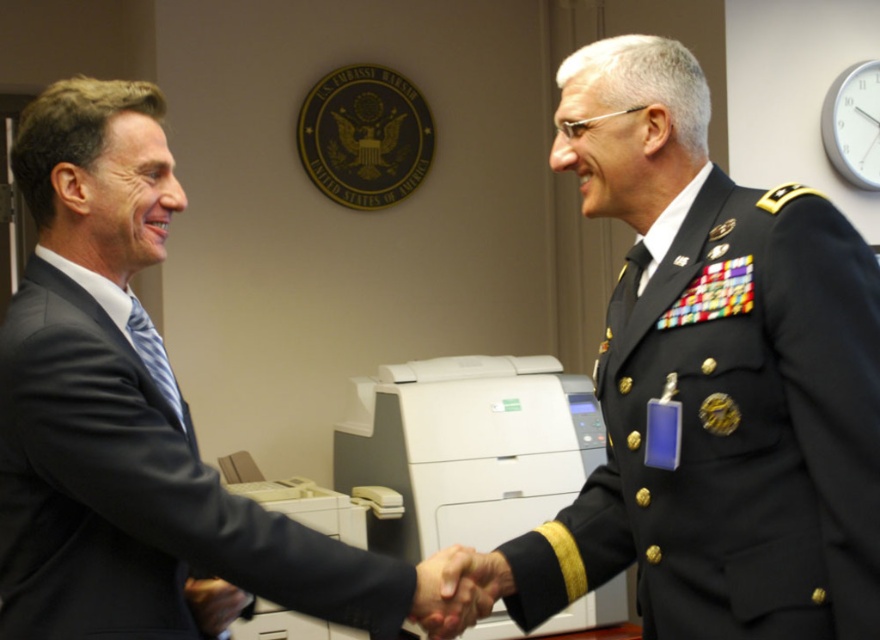
Is smooth skin handshake at center bigger than matte black hand at center?

Indeed, smooth skin handshake at center has a larger size compared to matte black hand at center.

What are the coordinates of `smooth skin handshake at center` in the screenshot? It's located at (457, 589).

Which of these two, dark blue wool suit at center or white plastic printer at center, stands shorter?

With less height is dark blue wool suit at center.

Is point (20, 316) more distant than point (528, 442)?

No, it is not.

Find the location of `dark blue wool suit at center`. dark blue wool suit at center is located at coordinates (136, 496).

The height and width of the screenshot is (640, 880). What are the coordinates of `dark blue wool suit at center` in the screenshot? It's located at (136, 496).

Based on the photo, does dark blue wool suit at center have a lesser width compared to matte black hand at center?

No.

Identify the location of dark blue wool suit at center. (136, 496).

Image resolution: width=880 pixels, height=640 pixels. I want to click on dark blue wool suit at center, so click(x=136, y=496).